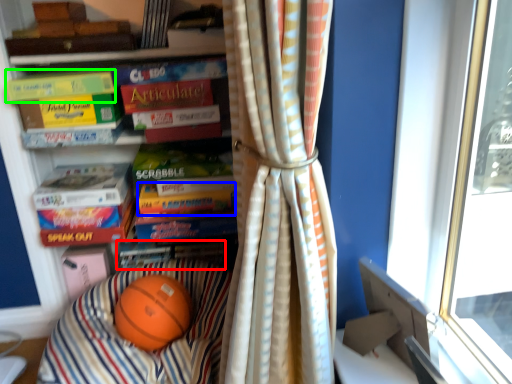
Question: Which object is the closest to the book (highlighted by a red box)? Choose among these: paperback book (highlighted by a blue box) or paperback book (highlighted by a green box).

Choices:
 (A) paperback book
 (B) paperback book

Answer: (A)